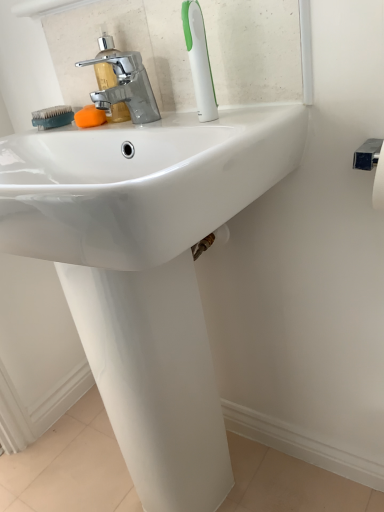
Question: From a real-world perspective, relative to chrome metallic faucet at upper left, is orange sponge at center vertically above or below?

Choices:
 (A) below
 (B) above

Answer: (A)

Question: Considering the positions of orange sponge at center and chrome metallic faucet at upper left in the image, is orange sponge at center bigger or smaller than chrome metallic faucet at upper left?

Choices:
 (A) small
 (B) big

Answer: (A)

Question: Considering the real-world distances, which object is farthest from the chrome metallic faucet at upper left?

Choices:
 (A) teal rubber brush at left
 (B) orange sponge at center
 (C) white plastic toothbrush at upper center

Answer: (C)

Question: Which object is positioned closest to the white plastic toothbrush at upper center?

Choices:
 (A) orange sponge at center
 (B) teal rubber brush at left
 (C) chrome metallic faucet at upper left

Answer: (C)